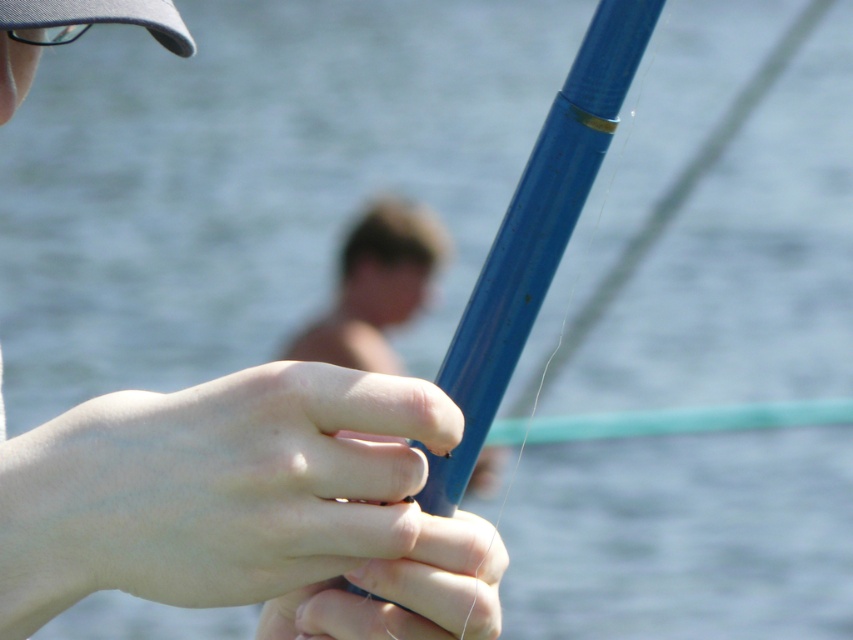
You are holding a blue fishing rod and want to cast your line to a specific point in the water. The point you want to reach is located at coordinates point (305, 636). If your fishing line can extend up to 30 inches, will you be able to reach that point?

The distance of point (305, 636) from camera is 29.59 inches. Since your fishing line can extend up to 30 inches, you can reach the point as 29.59 inches is within the line length limit.

You are a photographer trying to capture the blue plastic fishing pole at center and the matte blue pole at center in a single shot. Which pole should you adjust your camera to focus on if you want to highlight the one that is more to the right?

The blue plastic fishing pole at center is positioned on the right side of matte blue pole at center, so you should focus on the blue plastic fishing pole at center to highlight the one more to the right.

You are a photographer standing 24 inches away from the matte blue pole at center. Can you adjust your position to get the pole in focus without moving it?

The matte blue pole at center is currently 23.34 inches away from you. Since you are standing 24 inches away, you need to move 0.66 inches closer to align with the pole to focus it properly.